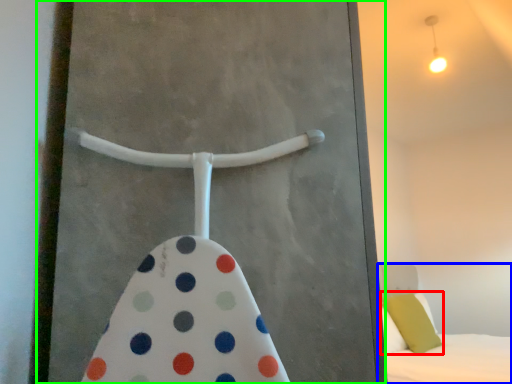
Question: Based on their relative distances, which object is farther from pillow (highlighted by a red box)? Choose from bed (highlighted by a blue box) and screen door (highlighted by a green box).

Choices:
 (A) bed
 (B) screen door

Answer: (B)